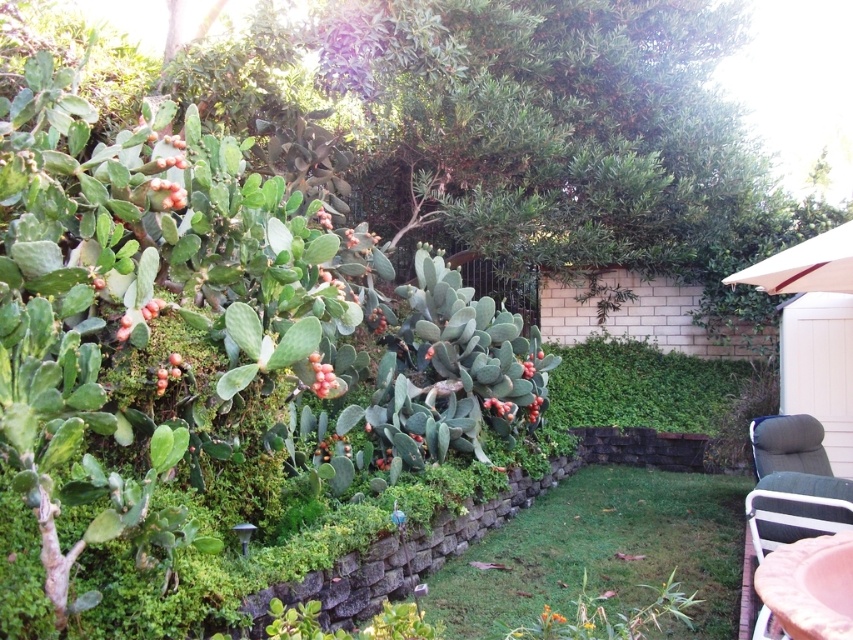
You are planning to host a small gathering in the garden and need to seat guests. You have two chairs available, the pink fabric chair at lower right and the gray fabric chair at lower right. Which chair can accommodate more guests if you need to place them side by side?

The gray fabric chair at lower right has a greater width than the pink fabric chair at lower right, so it can accommodate more guests when placed side by side.

Consider the image. You are sitting on the gray fabric chair at lower right and want to place a small potted plant on the ground. Where should you put it so that it is on the same level as the green grass at center?

You should place the small potted plant on the ground at the green grass at center since it is at the same level as the gray fabric chair at lower right.